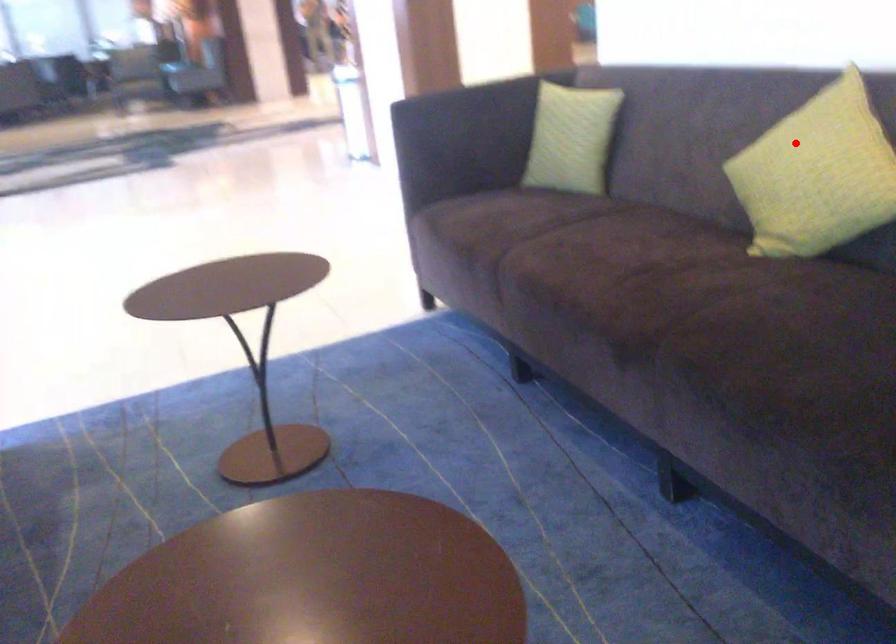
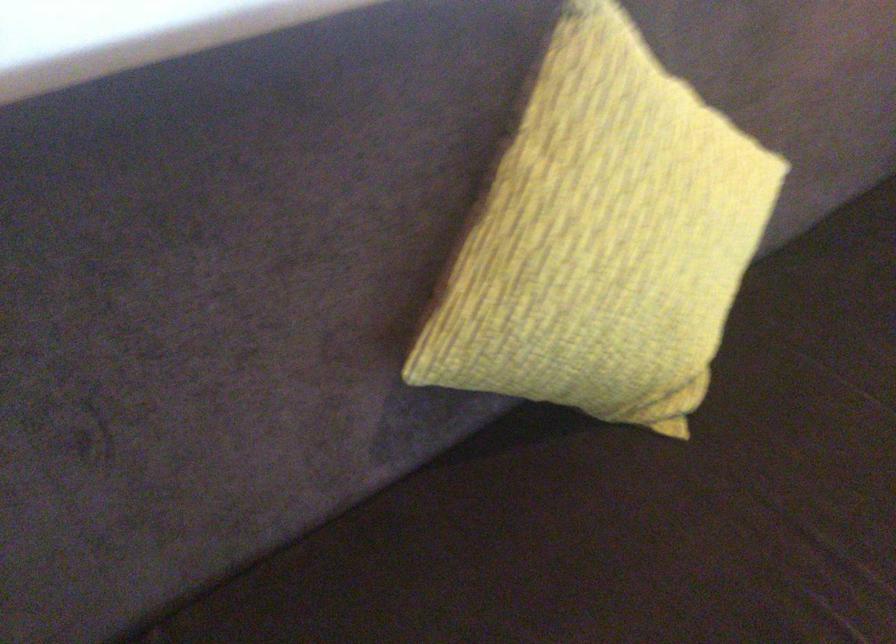
The point at the highlighted location is marked in the first image. Where is the corresponding point in the second image?

(602, 237)